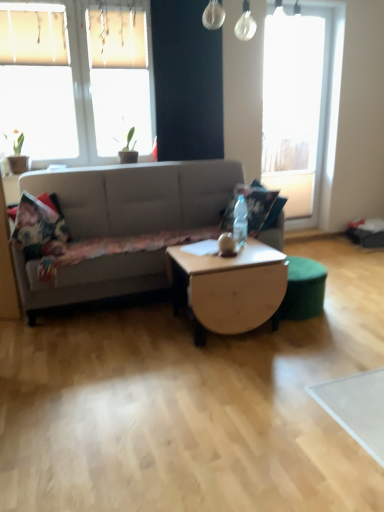
This screenshot has width=384, height=512. I want to click on vacant space that is in between matte gray studio couch at center and wooden coffee table at center, so click(x=129, y=335).